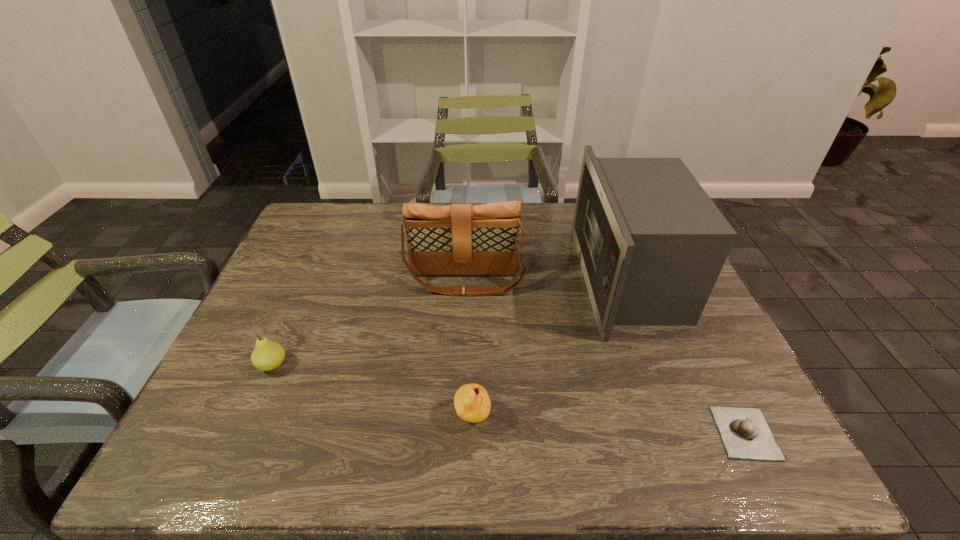
Find the location of a particular element. free space located on the right of the leftmost object is located at coordinates (371, 365).

Locate an element on the screen. The height and width of the screenshot is (540, 960). vacant space situated 0.060m on the left of the right pear is located at coordinates (426, 417).

What are the coordinates of `vacant space located 0.160m on the left of the garlic` in the screenshot? It's located at (637, 433).

Where is `object that is at the far edge`? This screenshot has height=540, width=960. object that is at the far edge is located at coordinates (651, 243).

This screenshot has width=960, height=540. I want to click on pear located in the near edge section of the desktop, so click(x=472, y=403).

I want to click on garlic situated at the near edge, so click(x=745, y=434).

Where is `object at the left edge`? The height and width of the screenshot is (540, 960). object at the left edge is located at coordinates (267, 355).

What are the coordinates of `microwave oven positioned at the right edge` in the screenshot? It's located at (651, 243).

I want to click on garlic positioned at the right edge, so (745, 434).

You are a GUI agent. You are given a task and a screenshot of the screen. Output one action in this format:
    pyautogui.click(x=<x>, y=<y>)
    Task: Click on the object situated at the far right corner
    The width and height of the screenshot is (960, 540).
    Given the screenshot: What is the action you would take?
    pyautogui.click(x=651, y=243)